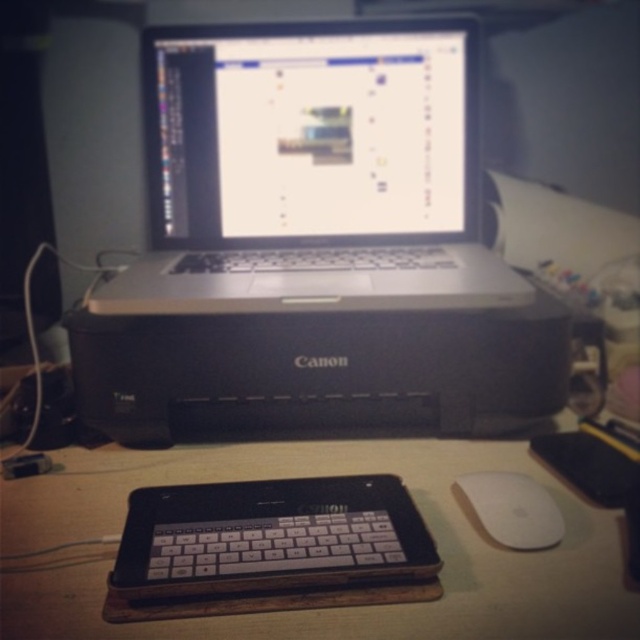
Identify the location of silver/black plastic printer at center. Image resolution: width=640 pixels, height=640 pixels. (316, 241).

Which is below, silver/black plastic printer at center or matte silver laptop at center?

silver/black plastic printer at center

At what (x,y) coordinates should I click in order to perform the action: click on silver/black plastic printer at center. Please return your answer as a coordinate pair (x, y). The width and height of the screenshot is (640, 640). Looking at the image, I should click on (316, 241).

Identify the location of silver/black plastic printer at center. This screenshot has height=640, width=640. (316, 241).

Is silver/black plastic printer at center positioned in front of white matte mouse at lower right?

No, silver/black plastic printer at center is behind white matte mouse at lower right.

What do you see at coordinates (316, 241) in the screenshot?
I see `silver/black plastic printer at center` at bounding box center [316, 241].

Does point (360, 188) lie in front of point (499, 492)?

That is False.

This screenshot has width=640, height=640. Identify the location of silver/black plastic printer at center. (316, 241).

Is silver/black plastic printer at center in front of wooden table at center?

No, it is behind wooden table at center.

Can you confirm if silver/black plastic printer at center is taller than wooden table at center?

Yes, silver/black plastic printer at center is taller than wooden table at center.

The image size is (640, 640). What do you see at coordinates (316, 241) in the screenshot?
I see `silver/black plastic printer at center` at bounding box center [316, 241].

Locate an element on the screen. This screenshot has width=640, height=640. silver/black plastic printer at center is located at coordinates (316, 241).